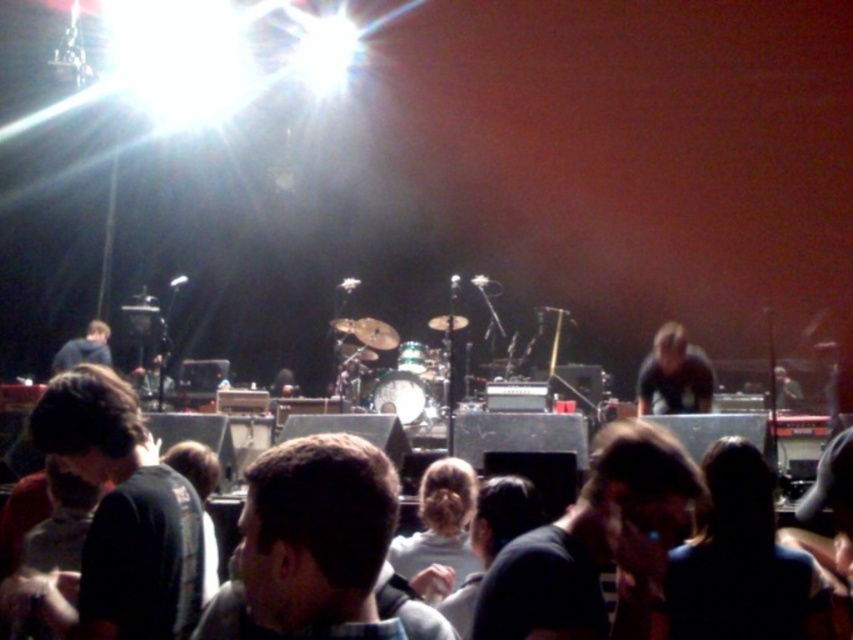
Question: Can you confirm if dark brown hair at center is positioned to the right of dark blue shirt at center?

Choices:
 (A) no
 (B) yes

Answer: (B)

Question: Which point is closer to the camera?

Choices:
 (A) (117, 596)
 (B) (91, 323)

Answer: (A)

Question: Can you confirm if black matte shirt at center is bigger than dark brown hair at center?

Choices:
 (A) yes
 (B) no

Answer: (A)

Question: Estimate the real-world distances between objects in this image. Which object is closer to the dark blue shirt at center?

Choices:
 (A) dark brown hair at center
 (B) light brown hair at center
 (C) dark gray shirt at center
 (D) brown hair at center

Answer: (B)

Question: Can you confirm if brown hair at center is positioned to the left of dark gray shirt at center?

Choices:
 (A) yes
 (B) no

Answer: (A)

Question: Which is nearer to the black matte shirt at center?

Choices:
 (A) dark blue shirt at center
 (B) dark brown hair at center
 (C) dark gray shirt at center
 (D) brown hair at center

Answer: (D)